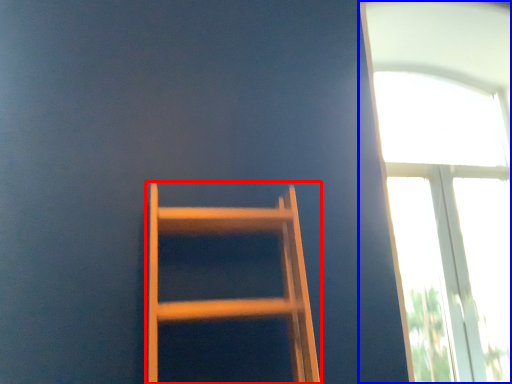
Question: Which of the following is the farthest to the observer, furniture (highlighted by a red box) or window (highlighted by a blue box)?

Choices:
 (A) furniture
 (B) window

Answer: (B)